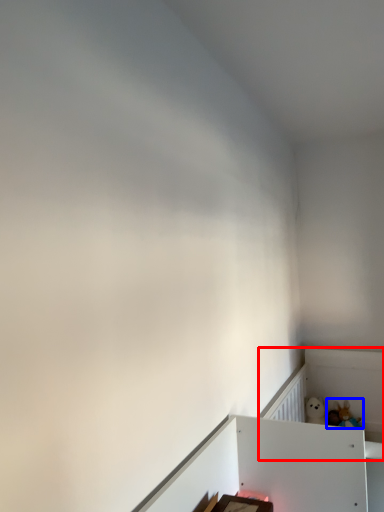
Question: Which point is further to the camera, bed frame (highlighted by a red box) or toy (highlighted by a blue box)?

Choices:
 (A) bed frame
 (B) toy

Answer: (B)